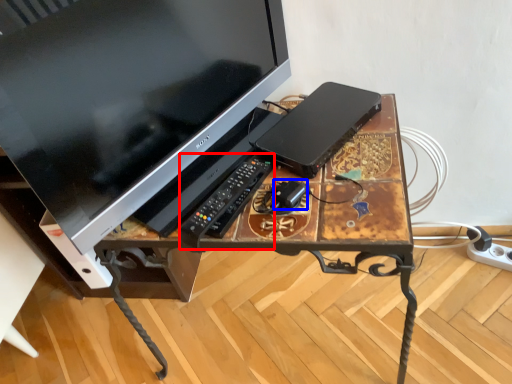
Question: Among these objects, which one is nearest to the camera, control (highlighted by a red box) or gadget (highlighted by a blue box)?

Choices:
 (A) control
 (B) gadget

Answer: (A)